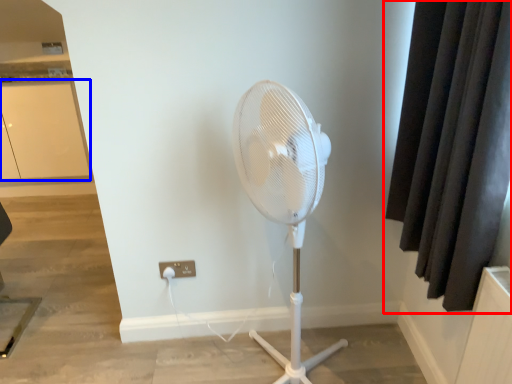
Question: Which point is further to the camera, curtain (highlighted by a red box) or screen door (highlighted by a blue box)?

Choices:
 (A) curtain
 (B) screen door

Answer: (B)